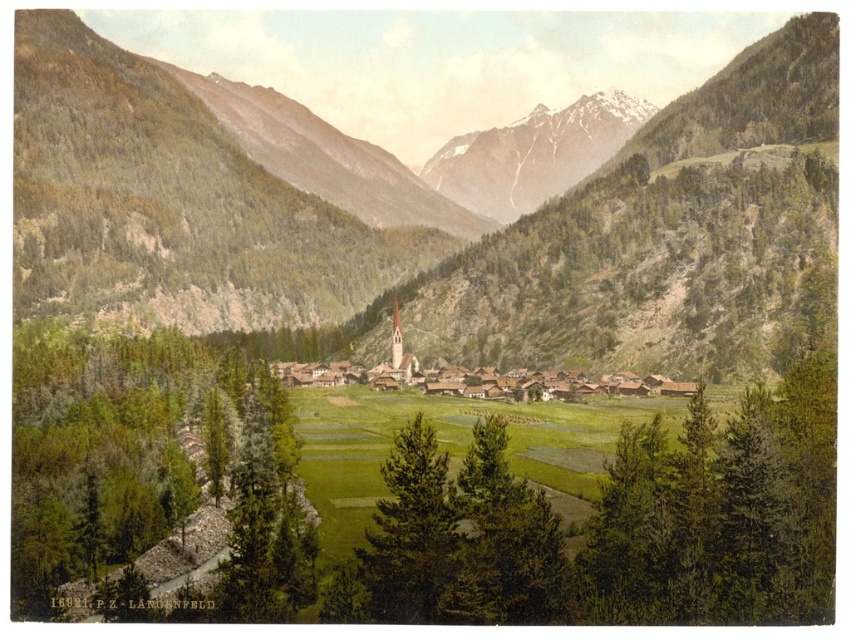
In the scene shown: You are an artist planning to paint this mountain valley scene. You want to ensure the green textured tree at left and the snowy granite mountain at upper center are proportionally accurate. Based on their sizes in the image, which object should appear smaller in your painting?

The green textured tree at left should appear smaller in the painting since it has a lesser height compared to the snowy granite mountain at upper center.

You are an artist trying to sketch this mountain valley scene. You want to place the green textured tree at left in your drawing. Where should you position it on a coordinate grid from 0 to 1 in both x and y axes?

The green textured tree at left should be positioned at the coordinate point of 0.744 in the x axis and 0.181 in the y axis.